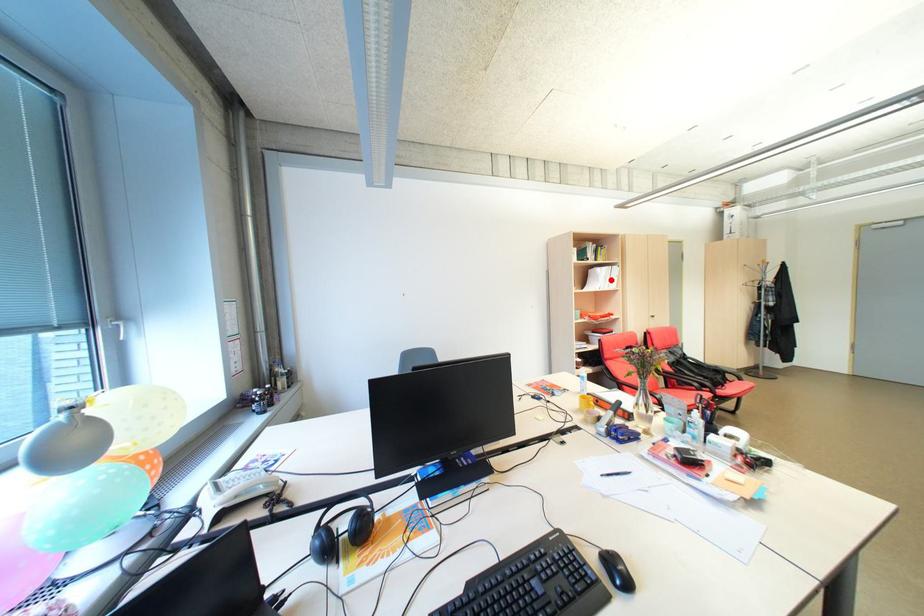
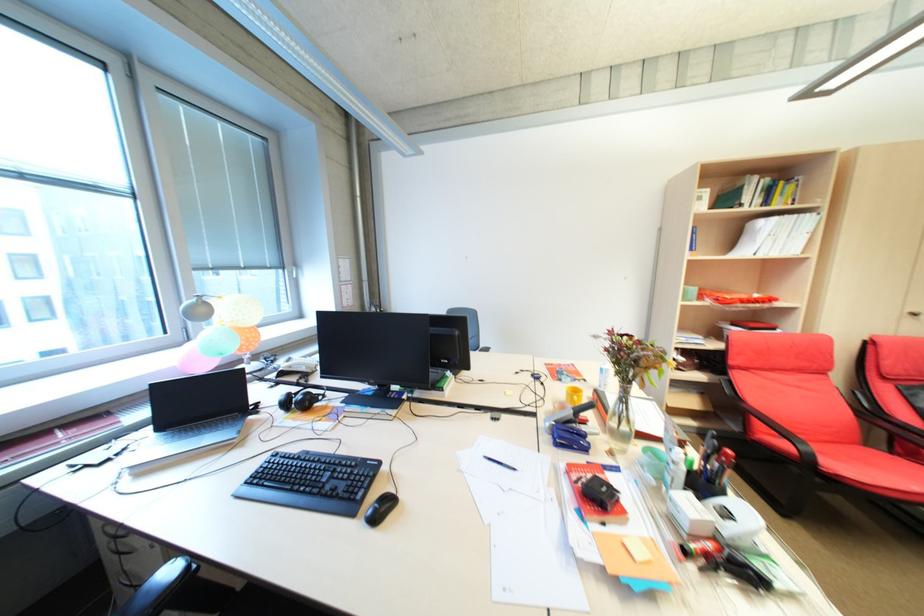
Locate, in the second image, the point that corresponds to the highlighted location in the first image.

(784, 240)